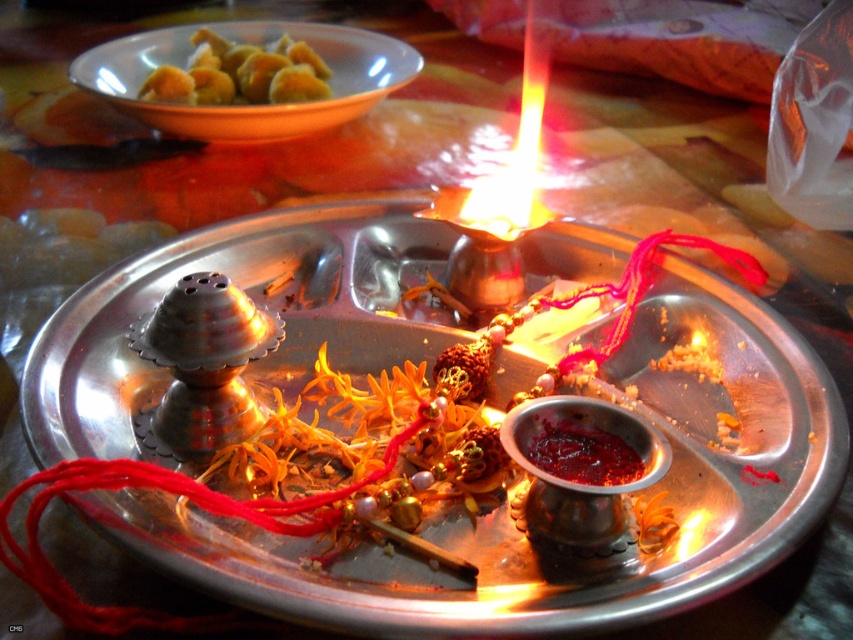
Question: Which of the following is the closest to the observer?

Choices:
 (A) shiny red paste at center
 (B) golden fried dumplings at upper left
 (C) metallic tray at center

Answer: (C)

Question: Which point is farther from the camera taking this photo?

Choices:
 (A) (540, 449)
 (B) (282, 60)
 (C) (335, 323)

Answer: (B)

Question: Can you confirm if metallic tray at center is positioned to the left of golden fried dumplings at upper left?

Choices:
 (A) yes
 (B) no

Answer: (B)

Question: Based on their relative distances, which object is nearer to the metallic tray at center?

Choices:
 (A) golden fried dumplings at upper left
 (B) shiny red paste at center

Answer: (B)

Question: Can you confirm if metallic tray at center is wider than shiny red paste at center?

Choices:
 (A) yes
 (B) no

Answer: (A)

Question: Does metallic tray at center lie in front of shiny red paste at center?

Choices:
 (A) yes
 (B) no

Answer: (A)